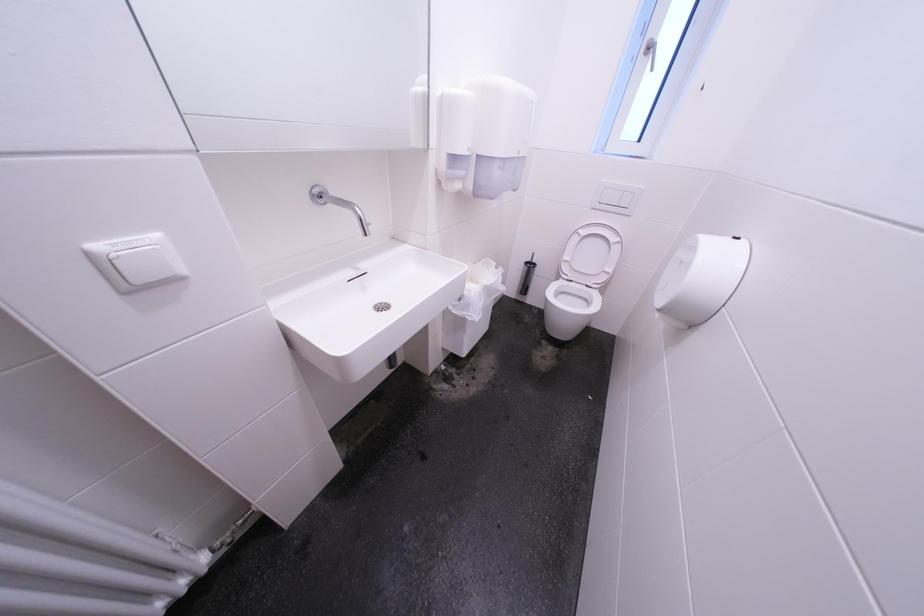
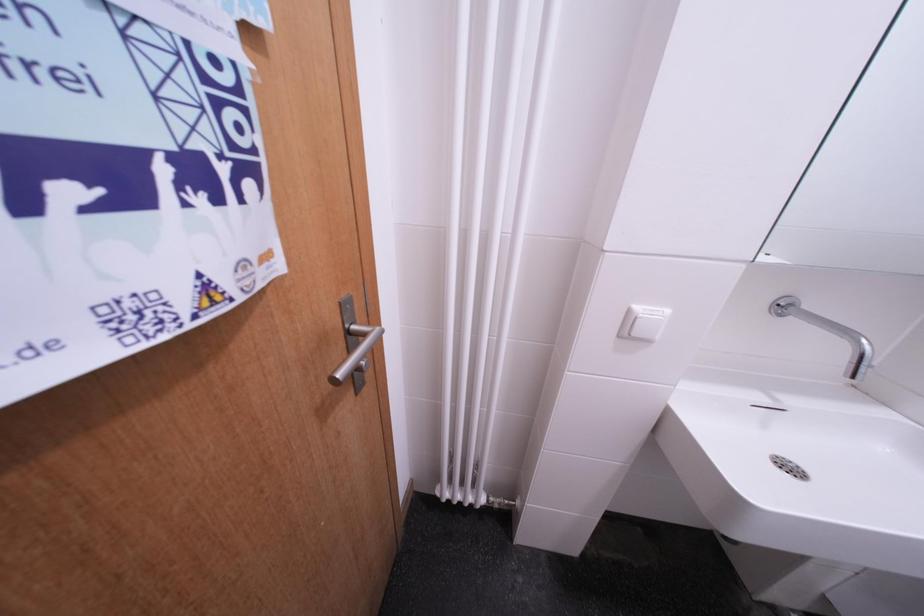
Question: The images are taken continuously from a first-person perspective. In which direction is your viewpoint rotating?

Choices:
 (A) Left
 (B) Right
 (C) Up
 (D) Down

Answer: (A)